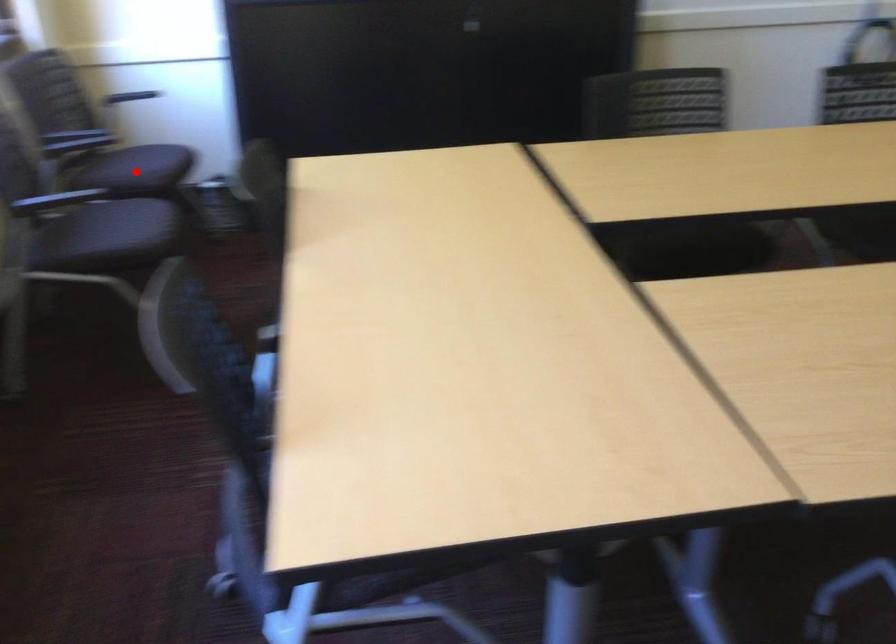
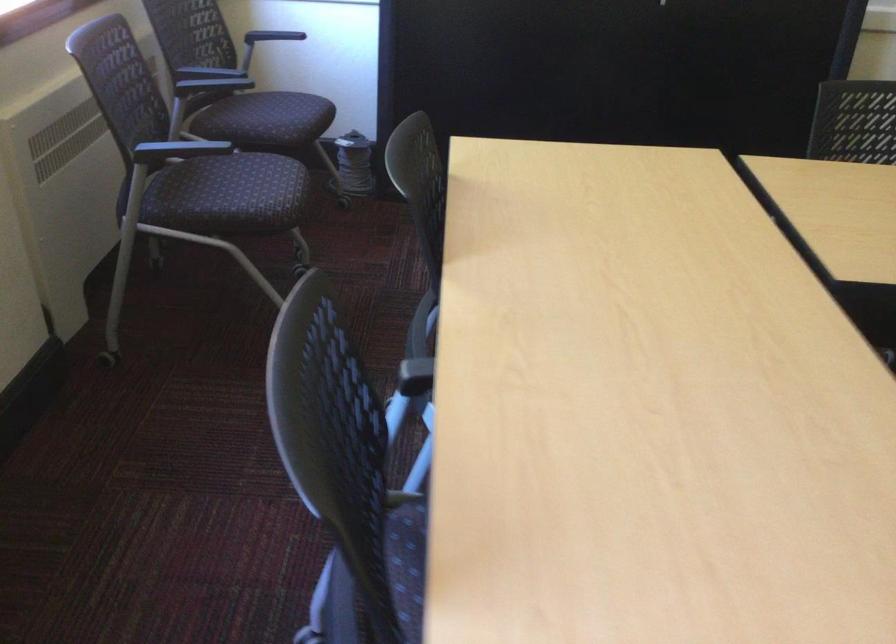
In the second image, find the point that corresponds to the highlighted location in the first image.

(271, 120)